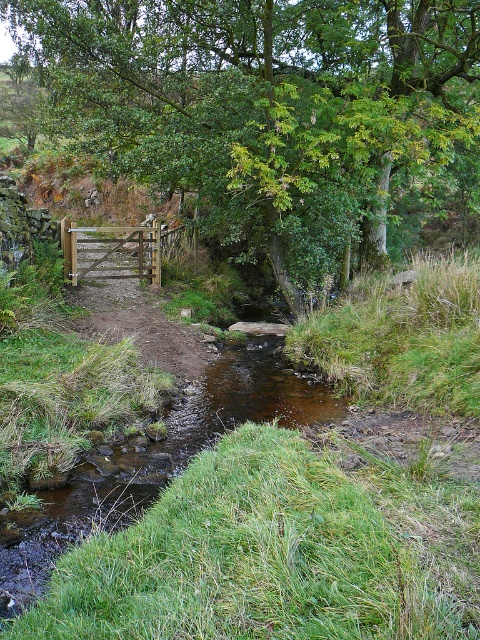
Does green leafy tree at upper center appear under brown wooden gate at center?

Incorrect, green leafy tree at upper center is not positioned below brown wooden gate at center.

Does green leafy tree at upper center appear on the right side of brown wooden gate at center?

Correct, you'll find green leafy tree at upper center to the right of brown wooden gate at center.

Does point (388, 100) come behind point (178, 372)?

Yes.

Where is `green leafy tree at upper center`? This screenshot has height=640, width=480. green leafy tree at upper center is located at coordinates (272, 109).